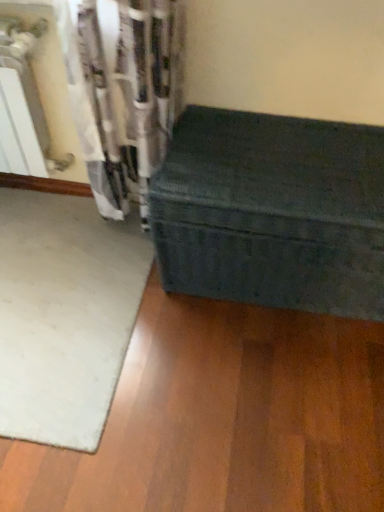
Describe the element at coordinates (272, 212) in the screenshot. This screenshot has width=384, height=512. I see `green fabric trunk at lower right` at that location.

In order to face green fabric trunk at lower right, should I rotate leftwards or rightwards?

To align with it, rotate right about 12.526°.

The image size is (384, 512). Identify the location of green fabric trunk at lower right. (272, 212).

Identify the location of white soft mat at lower left. (64, 314).

Describe the element at coordinates (64, 314) in the screenshot. This screenshot has height=512, width=384. I see `white soft mat at lower left` at that location.

The image size is (384, 512). I want to click on green fabric trunk at lower right, so click(x=272, y=212).

Between white soft mat at lower left and green fabric trunk at lower right, which one appears on the right side from the viewer's perspective?

Positioned to the right is green fabric trunk at lower right.

Considering their positions, is white soft mat at lower left located in front of or behind green fabric trunk at lower right?

white soft mat at lower left is behind green fabric trunk at lower right.

Does point (38, 245) come behind point (372, 157)?

Yes, point (38, 245) is farther from viewer.

From the image's perspective, is white soft mat at lower left beneath green fabric trunk at lower right?

Yes, from the image's perspective, white soft mat at lower left is below green fabric trunk at lower right.

From a real-world perspective, which is physically below, white soft mat at lower left or green fabric trunk at lower right?

From a 3D spatial view, white soft mat at lower left is below.

Does white soft mat at lower left have a lesser width compared to green fabric trunk at lower right?

No.

Considering the sizes of objects white soft mat at lower left and green fabric trunk at lower right in the image provided, who is shorter, white soft mat at lower left or green fabric trunk at lower right?

Standing shorter between the two is white soft mat at lower left.

Between white soft mat at lower left and green fabric trunk at lower right, which one has larger size?

Bigger between the two is green fabric trunk at lower right.

Is white soft mat at lower left completely or partially outside of green fabric trunk at lower right?

white soft mat at lower left is positioned outside green fabric trunk at lower right.

Is white soft mat at lower left far from green fabric trunk at lower right?

No, there isn't a large distance between white soft mat at lower left and green fabric trunk at lower right.

Is white soft mat at lower left facing towards green fabric trunk at lower right?

No, white soft mat at lower left is not facing towards green fabric trunk at lower right.

You are a GUI agent. You are given a task and a screenshot of the screen. Output one action in this format:
    pyautogui.click(x=<x>, y=<y>)
    Task: Click on the mat directly beneath the green fabric trunk at lower right (from a real-world perspective)
    The width and height of the screenshot is (384, 512).
    Given the screenshot: What is the action you would take?
    pyautogui.click(x=64, y=314)

Would you say green fabric trunk at lower right is to the left or to the right of white soft mat at lower left in the picture?

Clearly, green fabric trunk at lower right is on the right of white soft mat at lower left in the image.

In the image, is green fabric trunk at lower right positioned in front of or behind white soft mat at lower left?

Visually, green fabric trunk at lower right is located in front of white soft mat at lower left.

Is point (192, 121) less distant than point (43, 424)?

That is False.

From the image's perspective, between green fabric trunk at lower right and white soft mat at lower left, which one is located above?

green fabric trunk at lower right is shown above in the image.

From a real-world perspective, which is physically above, green fabric trunk at lower right or white soft mat at lower left?

green fabric trunk at lower right.

In terms of width, does green fabric trunk at lower right look wider or thinner when compared to white soft mat at lower left?

green fabric trunk at lower right is thinner than white soft mat at lower left.

Which of these two, green fabric trunk at lower right or white soft mat at lower left, stands taller?

Standing taller between the two is green fabric trunk at lower right.

Between green fabric trunk at lower right and white soft mat at lower left, which one has larger size?

green fabric trunk at lower right.

Is green fabric trunk at lower right surrounding white soft mat at lower left?

No, green fabric trunk at lower right does not contain white soft mat at lower left.

Is green fabric trunk at lower right in contact with white soft mat at lower left?

No, green fabric trunk at lower right is not touching white soft mat at lower left.

Consider the image. Is white soft mat at lower left at the back of green fabric trunk at lower right?

That's not correct — green fabric trunk at lower right is not looking away from white soft mat at lower left.

Measure the distance between green fabric trunk at lower right and white soft mat at lower left.

50.69 centimeters.

Locate an element on the screen. mat that appears on the left of green fabric trunk at lower right is located at coordinates (64, 314).

Find the location of `furniture that appears above the white soft mat at lower left (from a real-world perspective)`. furniture that appears above the white soft mat at lower left (from a real-world perspective) is located at coordinates (272, 212).

Where is `mat that is under the green fabric trunk at lower right (from a real-world perspective)`? This screenshot has width=384, height=512. mat that is under the green fabric trunk at lower right (from a real-world perspective) is located at coordinates (64, 314).